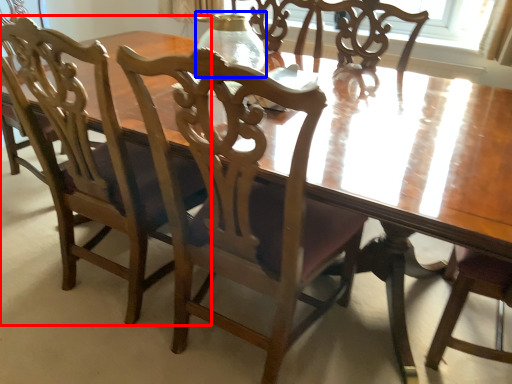
Question: Which object is closer to the camera taking this photo, chair (highlighted by a red box) or glass vase (highlighted by a blue box)?

Choices:
 (A) chair
 (B) glass vase

Answer: (A)